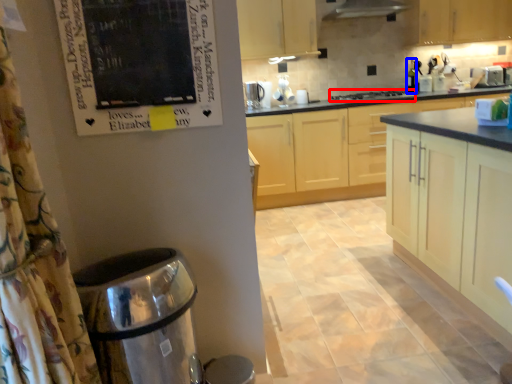
Question: Which of the following is the closest to the observer, home appliance (highlighted by a red box) or bottle (highlighted by a blue box)?

Choices:
 (A) home appliance
 (B) bottle

Answer: (A)